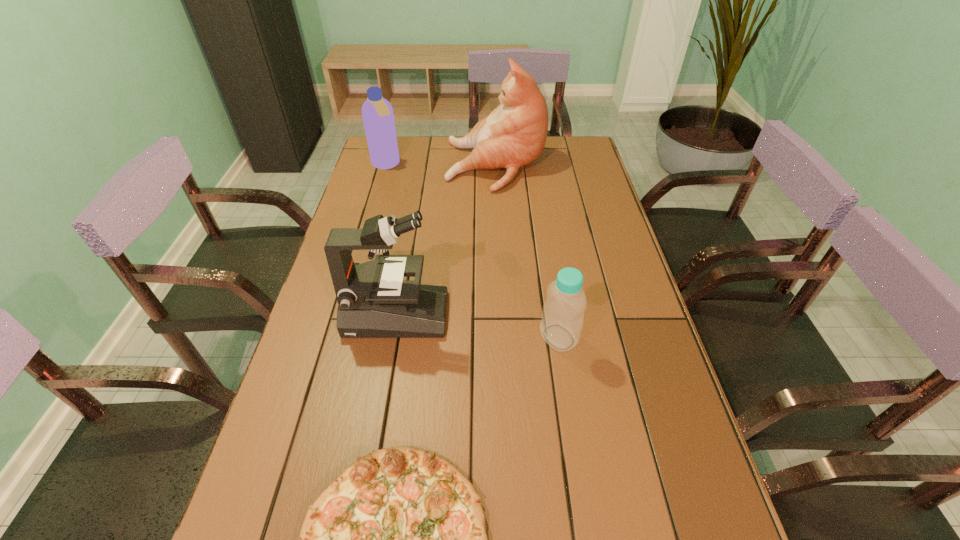
Locate an element on the screen. The image size is (960, 540). free area in between the bottle and the microscope is located at coordinates (477, 326).

Find the location of a particular element. This screenshot has width=960, height=540. vacant space that's between the cat and the second shortest object is located at coordinates (527, 251).

You are a GUI agent. You are given a task and a screenshot of the screen. Output one action in this format:
    pyautogui.click(x=<x>, y=<y>)
    Task: Click on the vacant space that's between the shampoo and the cat
    Image resolution: width=960 pixels, height=540 pixels.
    Given the screenshot: What is the action you would take?
    pyautogui.click(x=441, y=165)

You are a GUI agent. You are given a task and a screenshot of the screen. Output one action in this format:
    pyautogui.click(x=<x>, y=<y>)
    Task: Click on the object that stands as the closest to the pizza
    The image size is (960, 540).
    Given the screenshot: What is the action you would take?
    (x=561, y=324)

Locate an element on the screen. This screenshot has height=540, width=960. object that is the closest to the bottle is located at coordinates (374, 301).

Image resolution: width=960 pixels, height=540 pixels. What are the coordinates of `free space that satisfies the following two spatial constraints: 1. through the eyepieces of the fourth tallest object; 2. on the left side of the microscope` in the screenshot? It's located at (393, 337).

Where is `free spot that satisfies the following two spatial constraints: 1. through the eyepieces of the bottle; 2. on the right side of the microscope`? The image size is (960, 540). free spot that satisfies the following two spatial constraints: 1. through the eyepieces of the bottle; 2. on the right side of the microscope is located at coordinates (393, 337).

At what (x,y) coordinates should I click in order to perform the action: click on free point that satisfies the following two spatial constraints: 1. on the back side of the bottle; 2. on the face of the cat. Please return your answer as a coordinate pair (x, y). Looking at the image, I should click on (532, 166).

The width and height of the screenshot is (960, 540). I want to click on vacant space that satisfies the following two spatial constraints: 1. through the eyepieces of the microscope; 2. on the left side of the bottle, so pos(393,337).